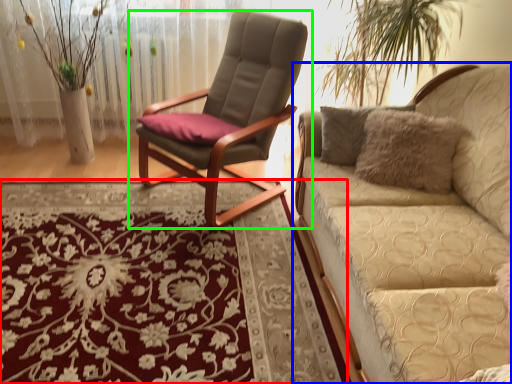
Question: Which object is positioned farthest from mat (highlighted by a red box)? Select from studio couch (highlighted by a blue box) and chair (highlighted by a green box).

Choices:
 (A) studio couch
 (B) chair

Answer: (A)